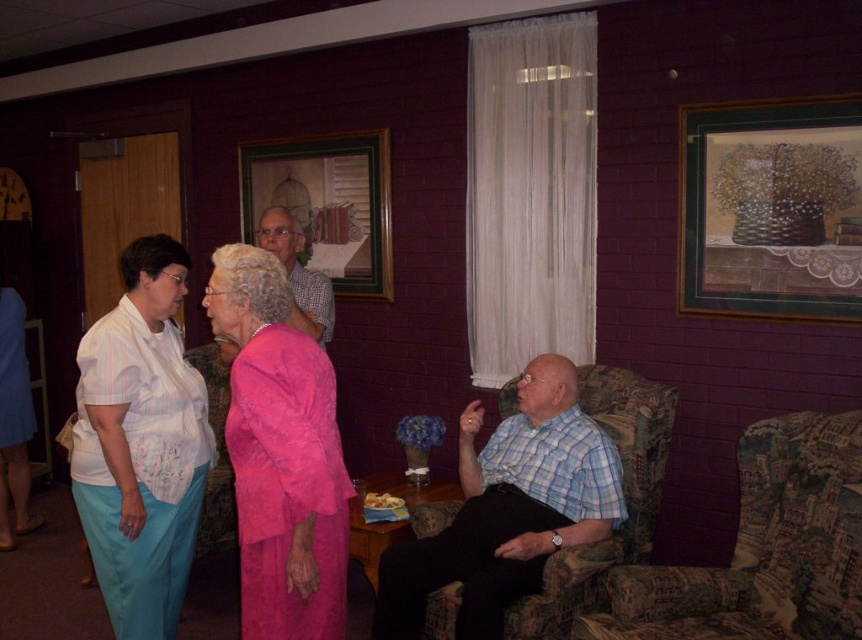
You are a photographer trying to capture a group photo of the matte white blouse at left and the checkered fabric shirt at center. Since you want to include both in the frame, which side should you position yourself relative to the subjects to ensure both are visible?

You should position yourself to the right of the subjects because the matte white blouse at left is on the left side of the checkered fabric shirt at center, so standing to the right would allow both to be in the frame without one blocking the other.